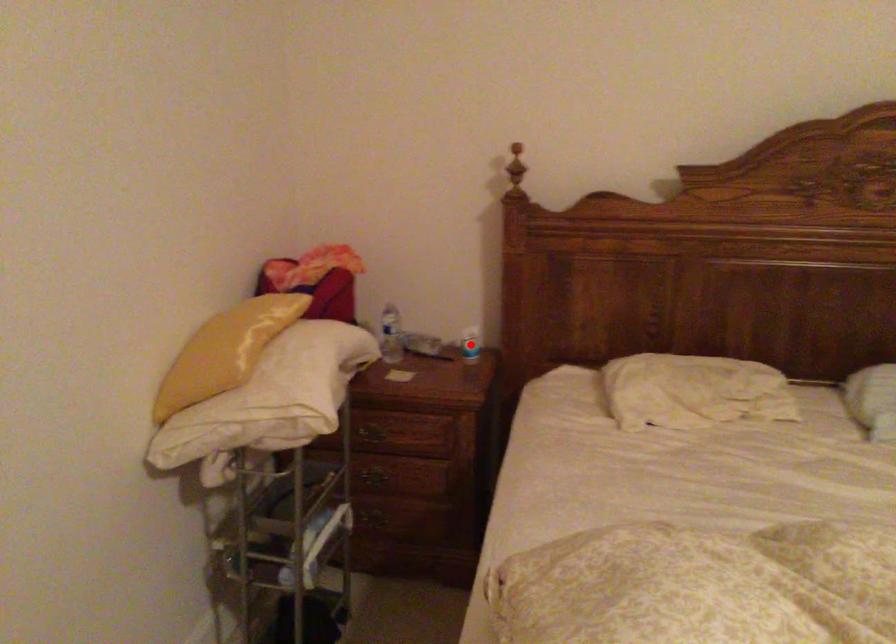
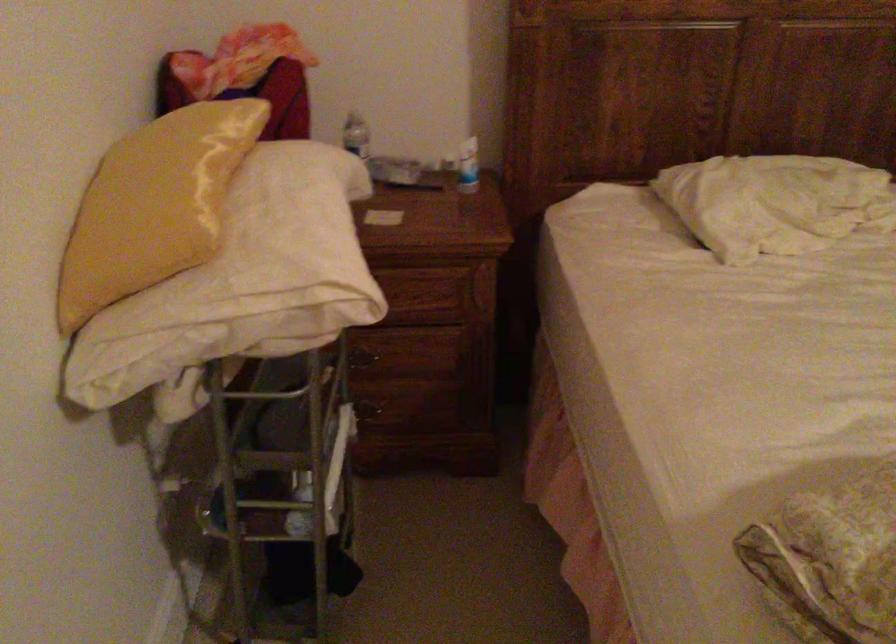
Question: I am providing you with two images of the same scene from different viewpoints. A red point is shown in image1. For the corresponding object point in image2, is it positioned nearer or farther from the camera?

Choices:
 (A) Nearer
 (B) Farther

Answer: (A)